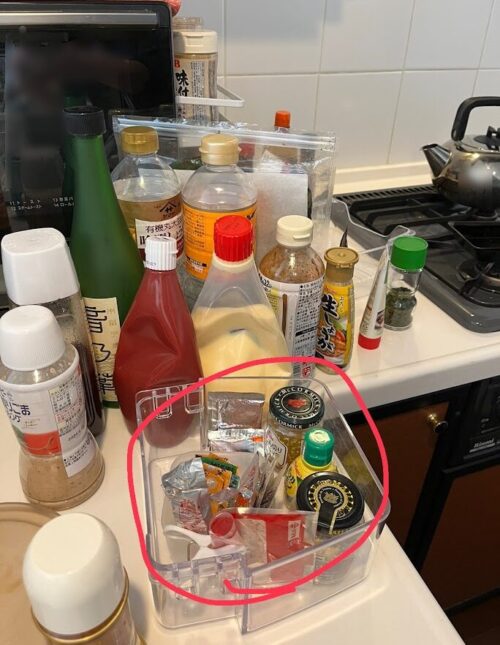
This screenshot has height=645, width=500. I want to click on wood cabinet, so click(x=408, y=452).